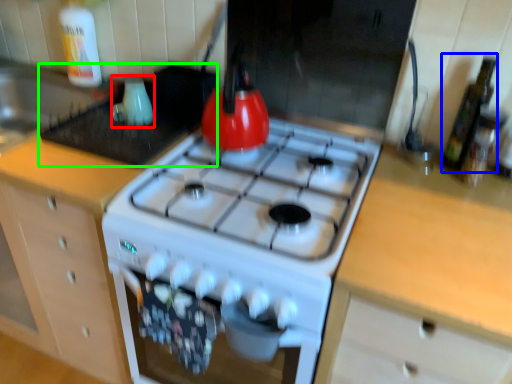
Question: Considering the real-world distances, which object is closest to appliance (highlighted by a red box)? bottle (highlighted by a blue box) or appliance (highlighted by a green box).

Choices:
 (A) bottle
 (B) appliance

Answer: (B)